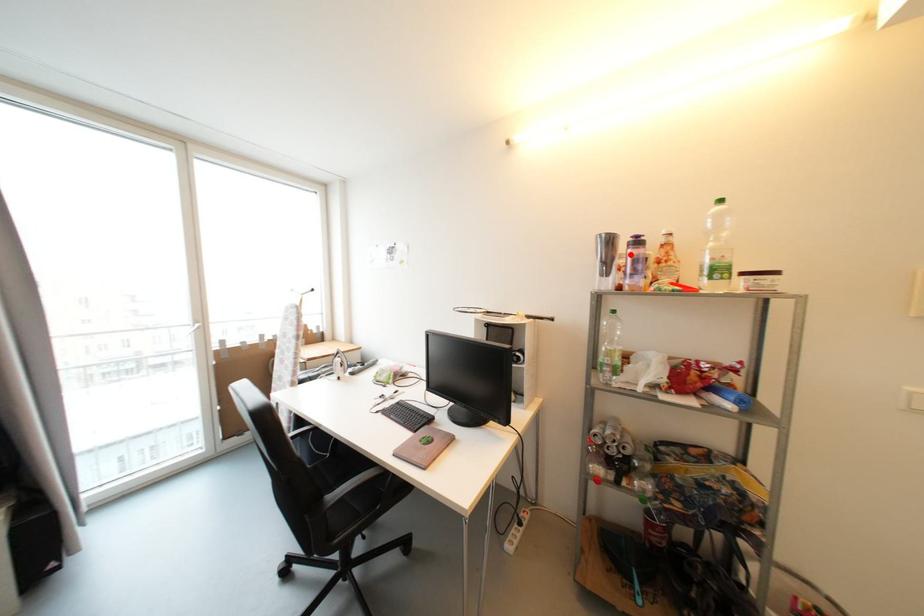
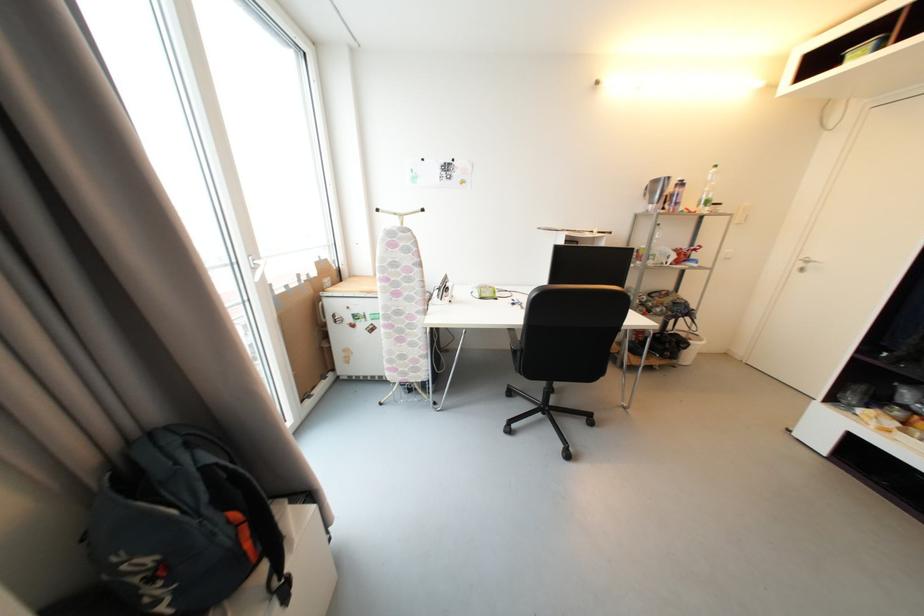
Find the pixel in the second image that matches the highlighted location in the first image.

(674, 192)